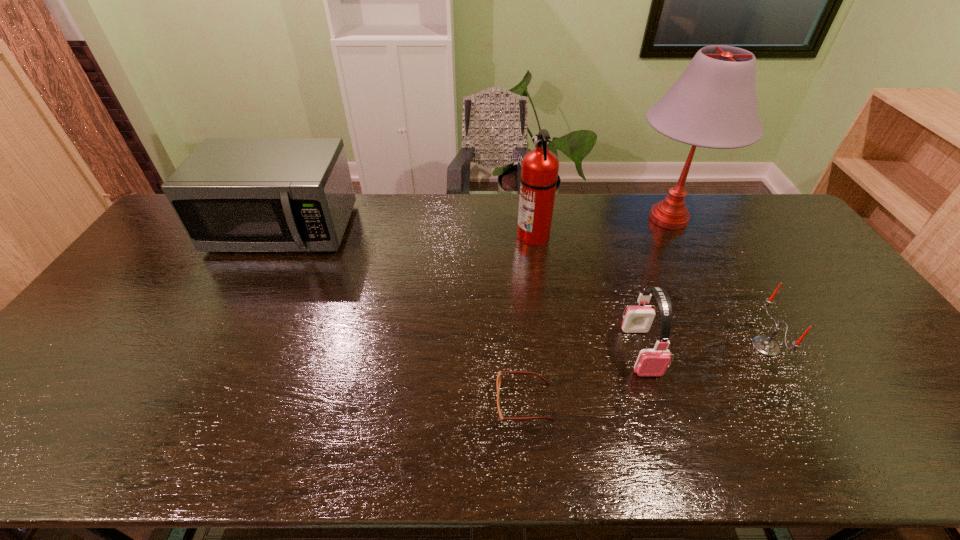
Where is `vacant point located between the tallest object and the fire extinguisher`? This screenshot has height=540, width=960. vacant point located between the tallest object and the fire extinguisher is located at coordinates pos(601,227).

At what (x,y) coordinates should I click in order to perform the action: click on object that can be found as the fourth closest to the spectacles. Please return your answer as a coordinate pair (x, y). The height and width of the screenshot is (540, 960). Looking at the image, I should click on (713, 104).

Identify which object is the nearest to the table lamp. Please provide its 2D coordinates. Your answer should be formatted as a tuple, i.e. [(x, y)], where the tuple contains the x and y coordinates of a point satisfying the conditions above.

[(539, 174)]